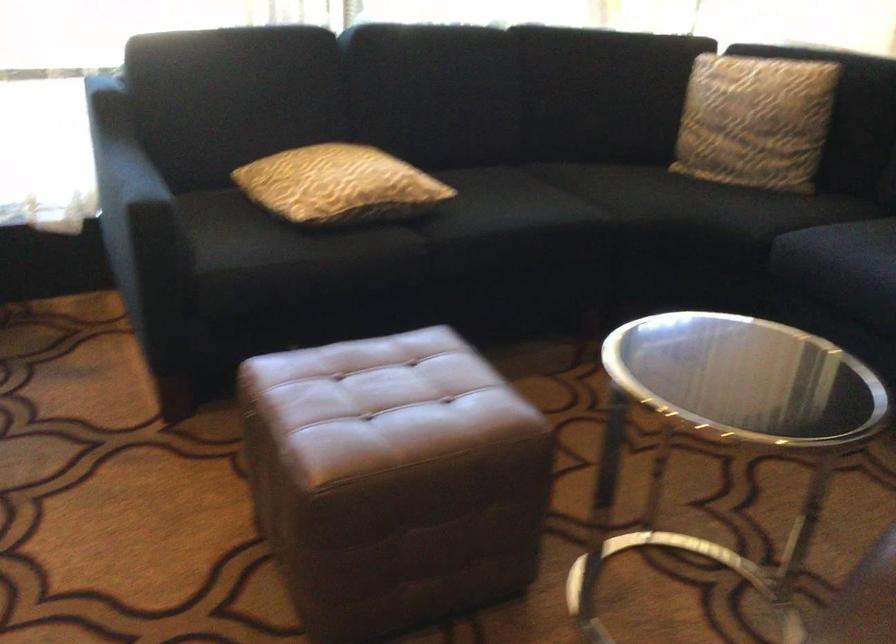
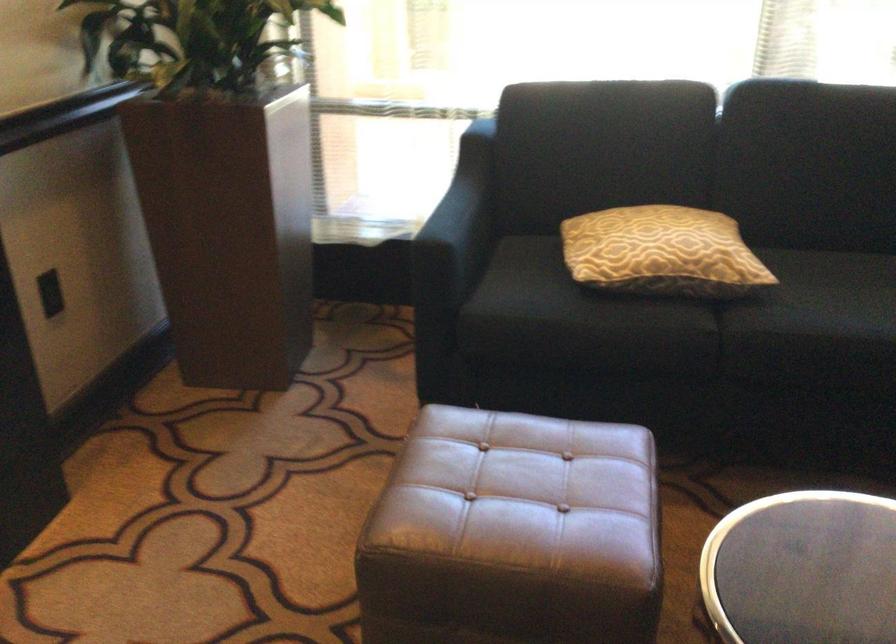
In the second image, find the point that corresponds to (x=157, y=187) in the first image.

(458, 225)